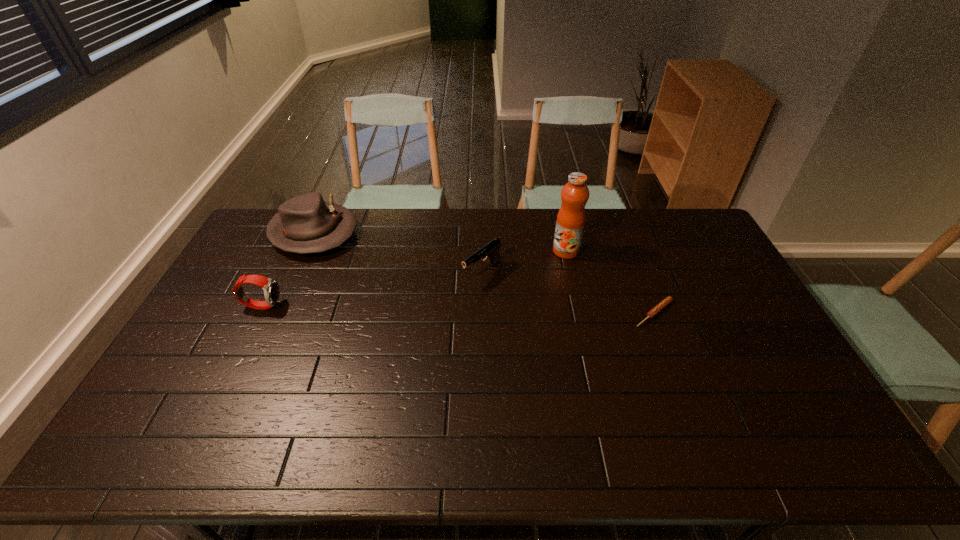
Where is `vacant position in the image that satisfies the following two spatial constraints: 1. on the front side of the tallest object; 2. on the left side of the hat`? This screenshot has height=540, width=960. vacant position in the image that satisfies the following two spatial constraints: 1. on the front side of the tallest object; 2. on the left side of the hat is located at coordinates (305, 251).

Locate an element on the screen. This screenshot has width=960, height=540. vacant space that satisfies the following two spatial constraints: 1. on the front side of the second object from right to left; 2. on the left side of the shortest object is located at coordinates (580, 314).